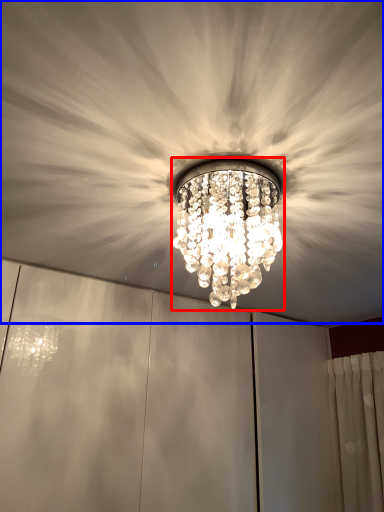
Question: Which object appears closest to the camera in this image, lamp (highlighted by a red box) or fan (highlighted by a blue box)?

Choices:
 (A) lamp
 (B) fan

Answer: (B)